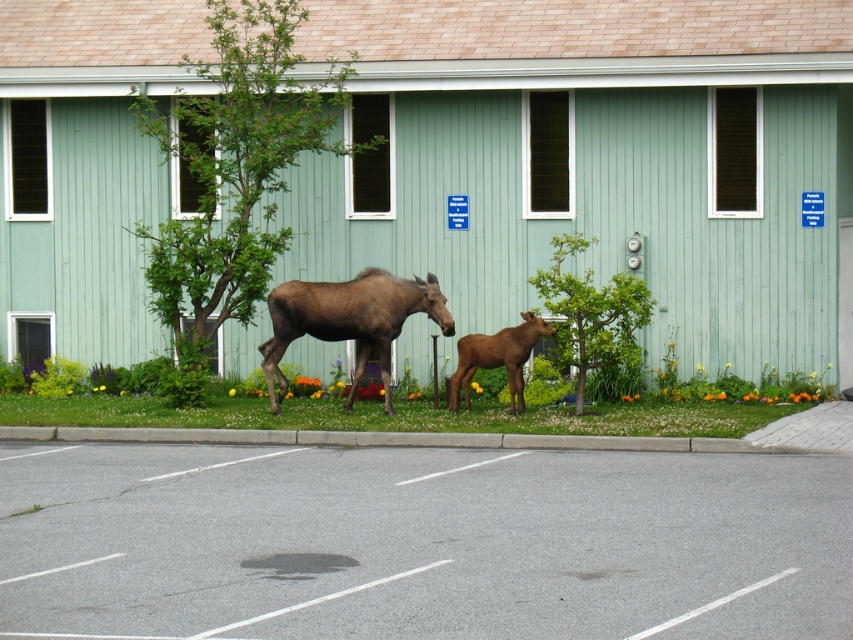
Who is higher up, green leafy tree at upper left or green leafy tree at center?

green leafy tree at upper left

Can you confirm if green leafy tree at upper left is positioned to the left of green leafy tree at center?

Indeed, green leafy tree at upper left is positioned on the left side of green leafy tree at center.

Is point (265, 256) positioned behind point (625, 324)?

Yes, it is behind point (625, 324).

This screenshot has width=853, height=640. What are the coordinates of `green leafy tree at upper left` in the screenshot? It's located at (233, 168).

Can you confirm if green leafy tree at upper left is positioned to the right of brown furry calf at center?

No, green leafy tree at upper left is not to the right of brown furry calf at center.

Locate an element on the screen. This screenshot has width=853, height=640. green leafy tree at upper left is located at coordinates (233, 168).

Describe the element at coordinates (233, 168) in the screenshot. I see `green leafy tree at upper left` at that location.

The image size is (853, 640). What are the coordinates of `green leafy tree at upper left` in the screenshot? It's located at (233, 168).

Who is positioned more to the right, gray asphalt parking lot at lower center or brown matte moose at center?

Positioned to the right is gray asphalt parking lot at lower center.

Measure the distance between gray asphalt parking lot at lower center and camera.

The distance of gray asphalt parking lot at lower center from camera is 29.73 feet.

Locate an element on the screen. gray asphalt parking lot at lower center is located at coordinates (421, 541).